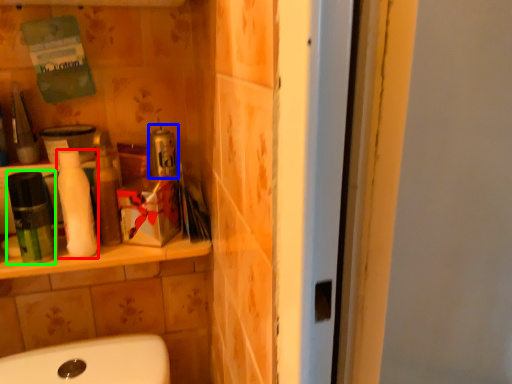
Question: Considering the real-world distances, which object is farthest from cleaning product (highlighted by a red box)? product (highlighted by a blue box) or mouthwash (highlighted by a green box)?

Choices:
 (A) product
 (B) mouthwash

Answer: (A)